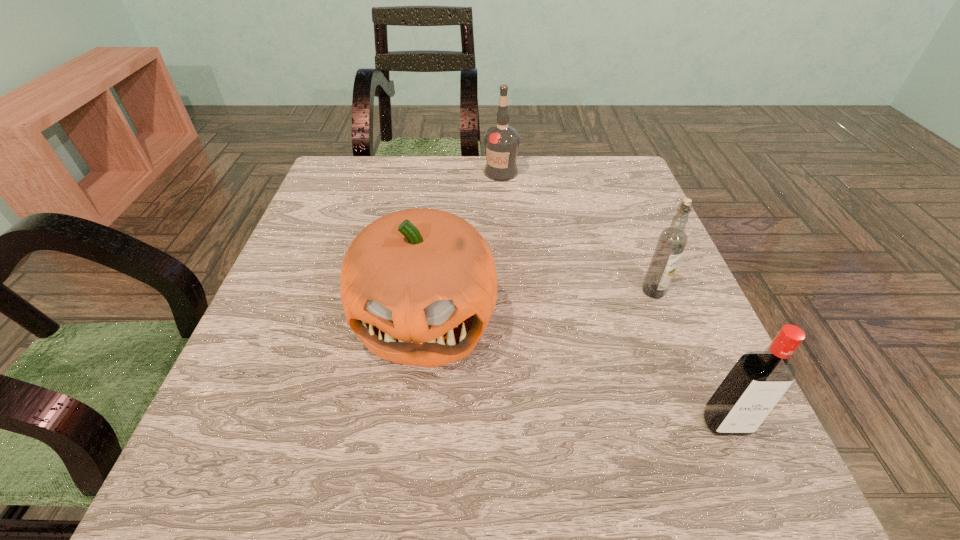
Locate an element on the screen. the farthest object is located at coordinates pos(501,142).

Find the location of a particular element. Image resolution: width=960 pixels, height=540 pixels. the farthest vodka is located at coordinates (501, 142).

Image resolution: width=960 pixels, height=540 pixels. Identify the location of pumpkin. (418, 286).

Locate an element on the screen. the nearest vodka is located at coordinates (759, 379).

Where is `the second nearest vodka`? The image size is (960, 540). the second nearest vodka is located at coordinates (672, 240).

At what (x,y) coordinates should I click in order to perform the action: click on free spot located on the front label of the leftmost vodka. Please return your answer as a coordinate pair (x, y). This screenshot has height=540, width=960. Looking at the image, I should click on (508, 272).

Where is `vacant space located 0.180m on the face of the pumpkin`? The width and height of the screenshot is (960, 540). vacant space located 0.180m on the face of the pumpkin is located at coordinates (404, 492).

This screenshot has width=960, height=540. Identify the location of free spot located on the front and back of the nearest object. (759, 502).

Where is `vacant region located 0.110m on the label of the second farthest vodka`? This screenshot has height=540, width=960. vacant region located 0.110m on the label of the second farthest vodka is located at coordinates click(x=675, y=345).

The width and height of the screenshot is (960, 540). What are the coordinates of `object that is at the far edge` in the screenshot? It's located at (501, 142).